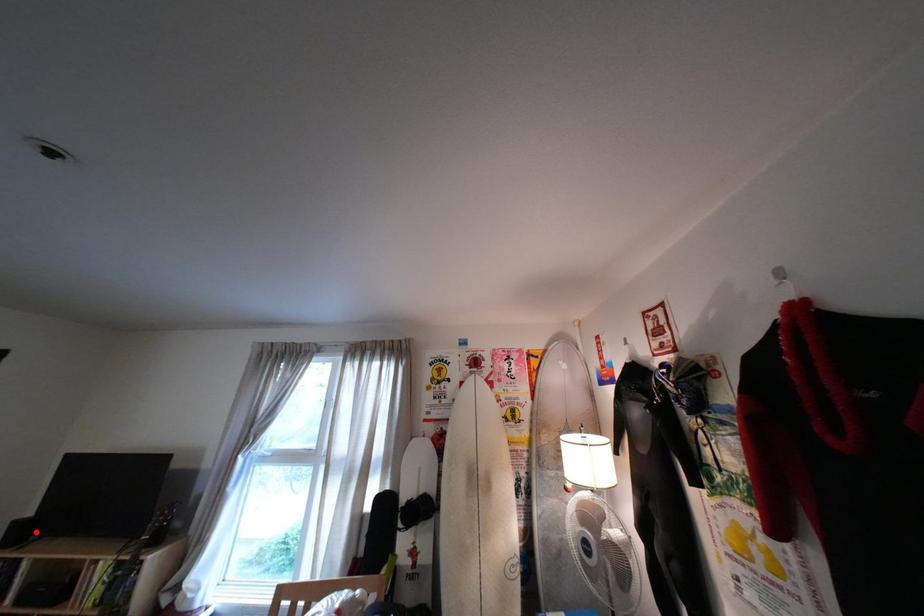
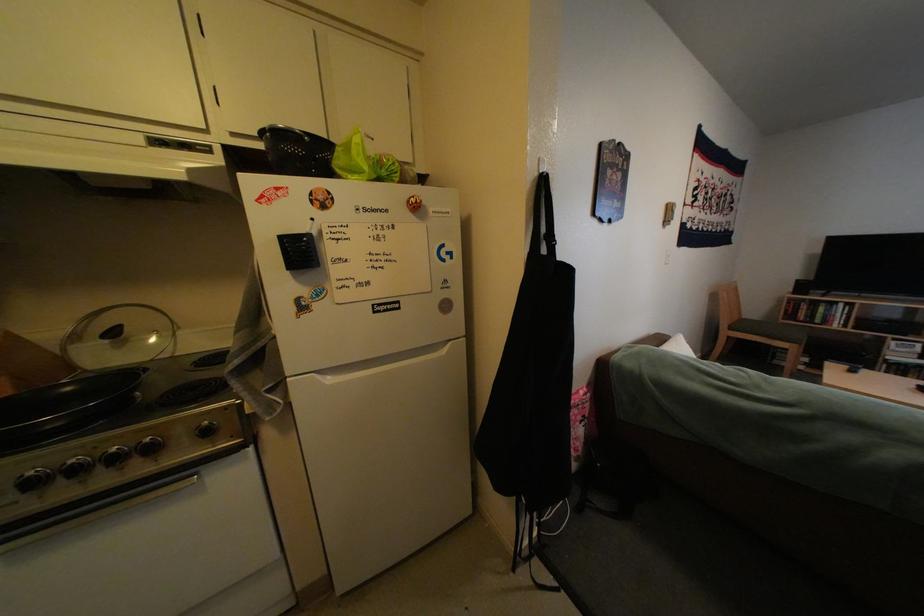
Question: I am providing you with two images of the same scene from different viewpoints. A red point is marked on the first image. At the location where the point appears in image 1, is it still visible in image 2?

Choices:
 (A) Yes
 (B) No

Answer: (A)